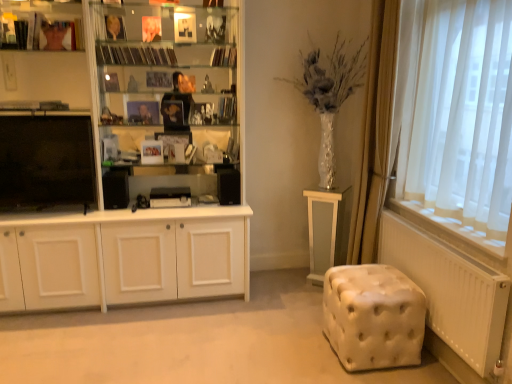
Question: Considering the positions of white glossy table at lower right and black matte bookshelf at upper center, the third book when ordered from right to left, in the image, is white glossy table at lower right wider or thinner than black matte bookshelf at upper center, the third book when ordered from right to left,?

Choices:
 (A) wide
 (B) thin

Answer: (A)

Question: From the image's perspective, relative to black matte bookshelf at upper center, the second book from the left, is white glossy table at lower right above or below?

Choices:
 (A) below
 (B) above

Answer: (A)

Question: Based on their relative distances, which object is nearer to the white glossy cupboard at left?

Choices:
 (A) hardcover book at upper center, which is counted as the fourth book, starting from the left
 (B) white glossy table at lower right
 (C) black matte bookshelf at upper center, the third book when ordered from right to left
 (D) gold metallic book at upper center, the 4th book viewed from the right
 (E) matte black books at upper left

Answer: (C)

Question: Estimate the real-world distances between objects in this image. Which object is farther from the matte black books at upper left?

Choices:
 (A) hardcover book at upper center, the 3th book in the left-to-right sequence
 (B) gold metallic book at upper center, the 4th book viewed from the right
 (C) black matte bookshelf at upper center, the third book when ordered from right to left
 (D) white glossy table at lower right
 (E) white glossy cupboard at left

Answer: (D)